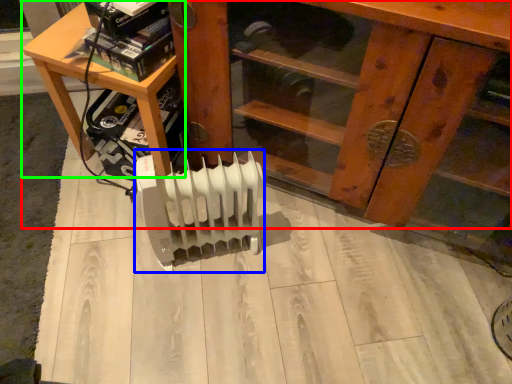
Question: Which is farther away from furniture (highlighted by a red box)? heater (highlighted by a blue box) or table (highlighted by a green box)?

Choices:
 (A) heater
 (B) table

Answer: (A)